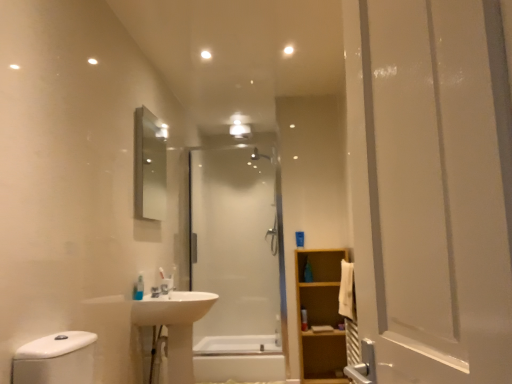
Identify the location of white glossy sink at center. This screenshot has width=512, height=384. (175, 326).

You are a GUI agent. You are given a task and a screenshot of the screen. Output one action in this format:
    pyautogui.click(x=<x>, y=<y>)
    Task: Click on the translucent plastic soap dispenser at lower left, placed as the second toiletry when sorted from bottom to top
    
    Given the screenshot: What is the action you would take?
    pyautogui.click(x=138, y=288)

Locate an element on the screen. light brown wooden cabinet at right is located at coordinates (320, 315).

Measure the distance between point (230, 362) and camera.

The distance of point (230, 362) from camera is 11.83 feet.

Describe the element at coordinates (238, 359) in the screenshot. I see `white glossy bathtub at center` at that location.

The image size is (512, 384). Identify the location of white glossy sink at center. (175, 326).

From a real-world perspective, between translucent plastic soap dispenser at lower left, positioned as the first toiletry in top-to-bottom order, and silver metallic mirror at upper left, who is vertically higher?

In real-world perspective, silver metallic mirror at upper left is above.

Considering the relative positions of translucent plastic soap dispenser at lower left, placed as the first toiletry when sorted from left to right, and silver metallic mirror at upper left in the image provided, is translucent plastic soap dispenser at lower left, placed as the first toiletry when sorted from left to right, to the left of silver metallic mirror at upper left from the viewer's perspective?

Incorrect, translucent plastic soap dispenser at lower left, placed as the first toiletry when sorted from left to right, is not on the left side of silver metallic mirror at upper left.

Locate an element on the screen. The height and width of the screenshot is (384, 512). mirror on the left side of translucent plastic soap dispenser at lower left, placed as the first toiletry when sorted from left to right is located at coordinates (149, 167).

In the image, is translucent plastic bottle at center, which is the 2th toiletry in left-to-right order, positioned in front of or behind light brown wooden cabinet at right?

Clearly, translucent plastic bottle at center, which is the 2th toiletry in left-to-right order, is behind light brown wooden cabinet at right.

From a real-world perspective, between translucent plastic bottle at center, the 2th toiletry positioned from the top, and light brown wooden cabinet at right, who is vertically lower?

light brown wooden cabinet at right, from a real-world perspective.

Which is less distant, [301,314] or [325,293]?

Point [301,314] is positioned closer to the camera compared to point [325,293].

You are a GUI agent. You are given a task and a screenshot of the screen. Output one action in this format:
    pyautogui.click(x=<x>, y=<y>)
    Task: Click on the 1st toiletry to the left of the light brown wooden cabinet at right, counting from the anchor's position
    The image size is (512, 384).
    Given the screenshot: What is the action you would take?
    pyautogui.click(x=304, y=319)

Between white glossy bathtub at center and white glossy sink at center, which one has larger width?

white glossy bathtub at center is wider.

Considering the points (239, 355) and (192, 324), which point is behind, point (239, 355) or point (192, 324)?

Point (192, 324)

Is white glossy bathtub at center in front of or behind white glossy sink at center in the image?

In the image, white glossy bathtub at center appears behind white glossy sink at center.

Is white glossy bathtub at center completely or partially outside of white glossy sink at center?

white glossy bathtub at center is positioned outside white glossy sink at center.

This screenshot has width=512, height=384. There is a white glossy bathtub at center. Find the location of `mirror above it (from a real-world perspective)`. mirror above it (from a real-world perspective) is located at coordinates (149, 167).

Consider the image. Can you confirm if silver metallic mirror at upper left is shorter than white glossy bathtub at center?

Incorrect, the height of silver metallic mirror at upper left does not fall short of that of white glossy bathtub at center.

Is silver metallic mirror at upper left smaller than white glossy bathtub at center?

Indeed, silver metallic mirror at upper left has a smaller size compared to white glossy bathtub at center.

Is silver metallic mirror at upper left looking in the opposite direction of white glossy bathtub at center?

No, silver metallic mirror at upper left is not facing away from white glossy bathtub at center.

Is transparent glass shower at center bigger than translucent plastic soap dispenser at lower left, the first toiletry positioned from the front?

Yes.

Could you measure the distance between transparent glass shower at center and translucent plastic soap dispenser at lower left, which is counted as the second toiletry, starting from the back?

6.83 feet.

From the image's perspective, starting from the transparent glass shower at center, which toiletry is the 1st one below? Please provide its 2D coordinates.

[(138, 288)]

From a real-world perspective, is transparent glass shower at center beneath translucent plastic soap dispenser at lower left, the first toiletry positioned from the front?

No, from a real-world perspective, transparent glass shower at center is not beneath translucent plastic soap dispenser at lower left, the first toiletry positioned from the front.

Image resolution: width=512 pixels, height=384 pixels. Identify the location of mirror above the white glossy sink at center (from a real-world perspective). (149, 167).

Considering the sizes of objects white glossy sink at center and silver metallic mirror at upper left in the image provided, who is smaller, white glossy sink at center or silver metallic mirror at upper left?

silver metallic mirror at upper left.

Is white glossy sink at center positioned with its back to silver metallic mirror at upper left?

That's not correct — white glossy sink at center is not looking away from silver metallic mirror at upper left.

Does point (177, 338) appear closer or farther from the camera than point (142, 213)?

Clearly, point (177, 338) is closer to the camera than point (142, 213).

Between white glossy sink at lower center and transparent glass shower at center, which one has smaller width?

Thinner between the two is white glossy sink at lower center.

Considering the positions of objects white glossy sink at lower center and transparent glass shower at center in the image provided, who is more to the right, white glossy sink at lower center or transparent glass shower at center?

transparent glass shower at center.

How many degrees apart are the facing directions of white glossy sink at lower center and transparent glass shower at center?

96.2 degrees separate the facing orientations of white glossy sink at lower center and transparent glass shower at center.

Is white glossy sink at lower center situated inside transparent glass shower at center or outside?

white glossy sink at lower center is not inside transparent glass shower at center, it's outside.

You are a GUI agent. You are given a task and a screenshot of the screen. Output one action in this format:
    pyautogui.click(x=<x>, y=<y>)
    Task: Click on the toiletry that is the 1st object directly below the silver metallic mirror at upper left (from a real-world perspective)
    
    Given the screenshot: What is the action you would take?
    pyautogui.click(x=138, y=288)

Identify the location of toiletry behind the light brown wooden cabinet at right. (304, 319).

Which object lies nearer to the anchor point white glossy sink at lower center, white glossy sink at center or white glossy bathtub at center?

Based on the image, white glossy sink at center appears to be nearer to white glossy sink at lower center.

Looking at the image, which one is located closer to white glossy sink at lower center, transparent glass shower at center or translucent plastic bottle at center, the 2th toiletry positioned from the top?

translucent plastic bottle at center, the 2th toiletry positioned from the top, is positioned closer to the anchor white glossy sink at lower center.

From the image, which object appears to be nearer to white glossy sink at center, transparent glass shower at center or light brown wooden cabinet at right?

light brown wooden cabinet at right is positioned closer to the anchor white glossy sink at center.

Estimate the real-world distances between objects in this image. Which object is closer to silver metallic mirror at upper left, white glossy bathtub at center or white glossy sink at center?

Based on the image, white glossy sink at center appears to be nearer to silver metallic mirror at upper left.

Considering their positions, is silver metallic mirror at upper left positioned further to translucent plastic soap dispenser at lower left, the second toiletry positioned from the right, than translucent plastic bottle at center, the 1th toiletry in the right-to-left sequence?

The object further to translucent plastic soap dispenser at lower left, the second toiletry positioned from the right, is translucent plastic bottle at center, the 1th toiletry in the right-to-left sequence.

From the picture: Which object lies further to the anchor point translucent plastic bottle at center, the 2th toiletry positioned from the top, white glossy bathtub at center or white glossy sink at lower center?

white glossy sink at lower center.

Estimate the real-world distances between objects in this image. Which object is closer to light brown wooden cabinet at right, white glossy bathtub at center or silver metallic mirror at upper left?

white glossy bathtub at center is closer to light brown wooden cabinet at right.

From the image, which object appears to be farther from transparent glass shower at center, silver metallic mirror at upper left or translucent plastic bottle at center, arranged as the 1th toiletry when ordered from the bottom?

silver metallic mirror at upper left is further to transparent glass shower at center.

Identify the location of bath between translucent plastic soap dispenser at lower left, the second toiletry positioned from the right, and transparent glass shower at center from front to back. (238, 359).

Locate an element on the screen. Image resolution: width=512 pixels, height=384 pixels. bathroom cabinet between transparent glass shower at center and white glossy bathtub at center from top to bottom is located at coordinates [x=320, y=315].

Locate an element on the screen. This screenshot has height=384, width=512. plumbing fixture between transparent glass shower at center and white glossy bathtub at center in the up-down direction is located at coordinates (155, 292).

Image resolution: width=512 pixels, height=384 pixels. Find the location of `plumbing fixture between silver metallic mirror at upper left and white glossy sink at center from top to bottom`. plumbing fixture between silver metallic mirror at upper left and white glossy sink at center from top to bottom is located at coordinates (155, 292).